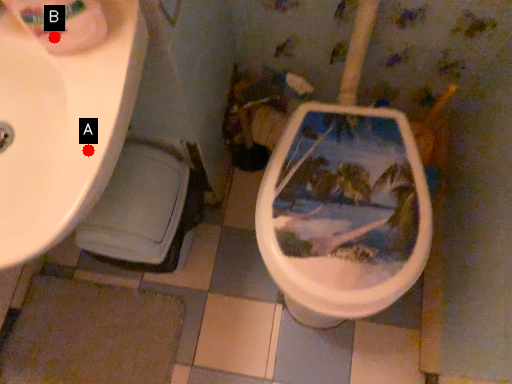
Question: Two points are circled on the image, labeled by A and B beside each circle. Which of the following is the farthest from the observer?

Choices:
 (A) A is further
 (B) B is further

Answer: (B)